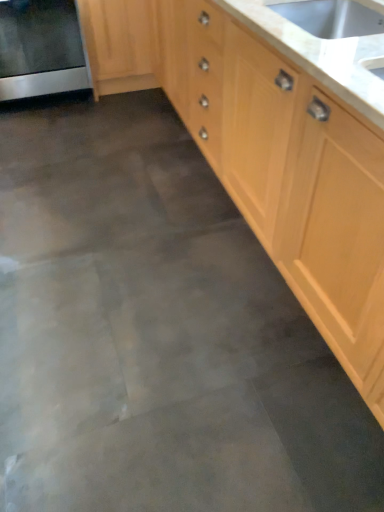
Question: From a real-world perspective, is white marble countertop at upper right physically below light wood cabinet at center, positioned as the first cabinetry in right-to-left order?

Choices:
 (A) yes
 (B) no

Answer: (B)

Question: Would you say white marble countertop at upper right is outside light wood cabinet at center, the second cabinetry when ordered from left to right?

Choices:
 (A) no
 (B) yes

Answer: (B)

Question: Is white marble countertop at upper right aimed at light wood cabinet at center, the second cabinetry when ordered from left to right?

Choices:
 (A) yes
 (B) no

Answer: (B)

Question: Is white marble countertop at upper right in front of light wood cabinet at center, the second cabinetry when ordered from left to right?

Choices:
 (A) yes
 (B) no

Answer: (B)

Question: From the image's perspective, is white marble countertop at upper right located beneath light wood cabinet at center, the second cabinetry when ordered from left to right?

Choices:
 (A) yes
 (B) no

Answer: (A)

Question: Considering the positions of light wood cabinet at center, the second cabinetry when ordered from left to right, and white marble countertop at upper right in the image, is light wood cabinet at center, the second cabinetry when ordered from left to right, wider or thinner than white marble countertop at upper right?

Choices:
 (A) thin
 (B) wide

Answer: (B)

Question: Looking at the image, does light wood cabinet at center, the second cabinetry when ordered from left to right, seem bigger or smaller compared to white marble countertop at upper right?

Choices:
 (A) small
 (B) big

Answer: (B)

Question: From the image's perspective, relative to white marble countertop at upper right, is light wood cabinet at center, the second cabinetry when ordered from left to right, above or below?

Choices:
 (A) below
 (B) above

Answer: (B)

Question: Is light wood cabinet at center, the second cabinetry when ordered from left to right, in front of or behind white marble countertop at upper right in the image?

Choices:
 (A) behind
 (B) front

Answer: (B)

Question: Considering the positions of white marble countertop at upper right and light wood/texture cabinet at upper left, the 1th cabinetry from the left, in the image, is white marble countertop at upper right wider or thinner than light wood/texture cabinet at upper left, the 1th cabinetry from the left,?

Choices:
 (A) wide
 (B) thin

Answer: (B)

Question: In the image, is white marble countertop at upper right on the left side or the right side of light wood/texture cabinet at upper left, the 2th cabinetry from the right?

Choices:
 (A) right
 (B) left

Answer: (A)

Question: From the image's perspective, is white marble countertop at upper right positioned above or below light wood/texture cabinet at upper left, the 2th cabinetry from the right?

Choices:
 (A) below
 (B) above

Answer: (A)

Question: Is white marble countertop at upper right bigger or smaller than light wood/texture cabinet at upper left, the 1th cabinetry from the left?

Choices:
 (A) small
 (B) big

Answer: (A)

Question: Do you think light wood/texture cabinet at upper left, the 2th cabinetry from the right, is within light wood cabinet at center, the second cabinetry when ordered from left to right, or outside of it?

Choices:
 (A) outside
 (B) inside

Answer: (A)

Question: From the image's perspective, is light wood/texture cabinet at upper left, the 1th cabinetry from the left, positioned above or below light wood cabinet at center, the second cabinetry when ordered from left to right?

Choices:
 (A) below
 (B) above

Answer: (B)